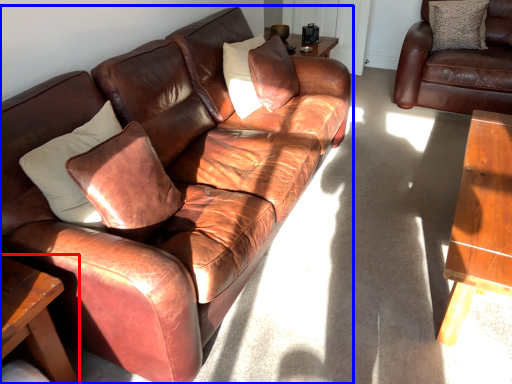
Question: Which object appears farthest to the camera in this image, table (highlighted by a red box) or studio couch (highlighted by a blue box)?

Choices:
 (A) table
 (B) studio couch

Answer: (A)